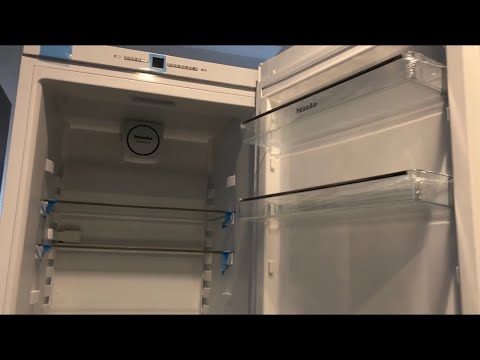
I want to click on ceiling, so click(257, 57).